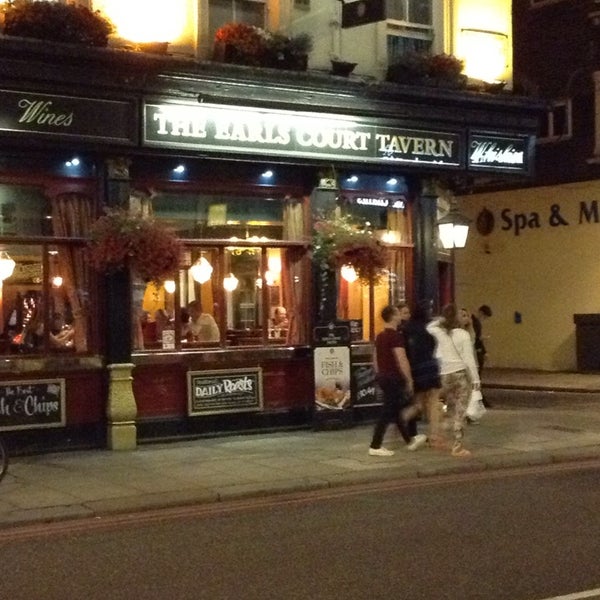
Image resolution: width=600 pixels, height=600 pixels. What are the coordinates of `tavern` in the screenshot? It's located at (288, 130).